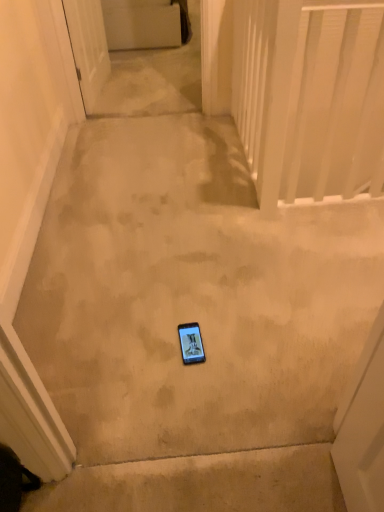
You are a GUI agent. You are given a task and a screenshot of the screen. Output one action in this format:
    pyautogui.click(x=<x>, y=<y>)
    Task: Click on the free location in front of matte black phone at center
    The image size is (384, 512).
    Given the screenshot: What is the action you would take?
    pyautogui.click(x=191, y=391)